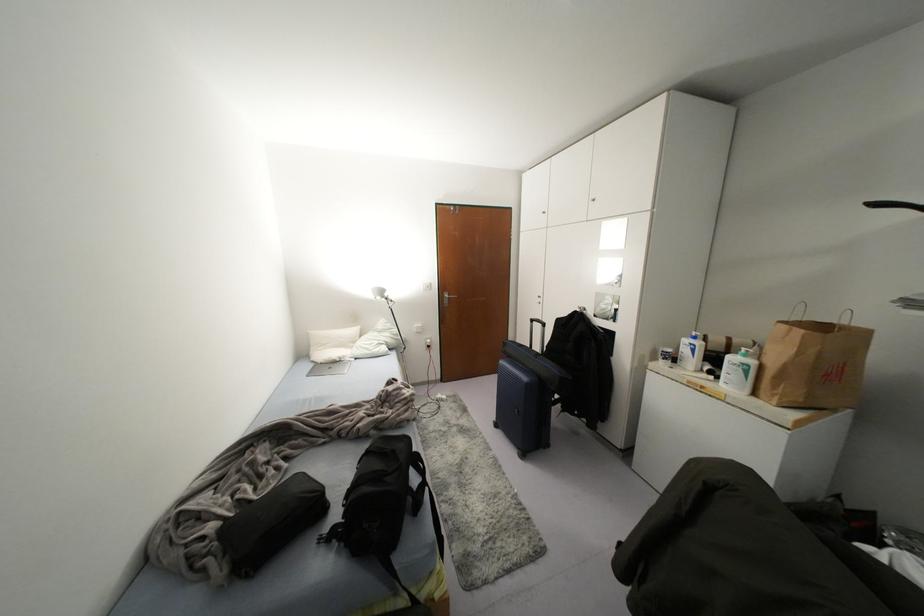
Describe the element at coordinates (536, 322) in the screenshot. I see `the suitcase handle` at that location.